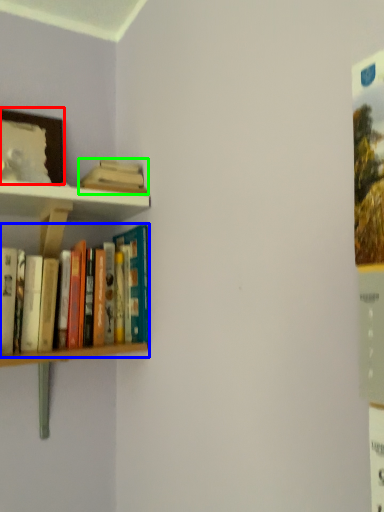
Question: Considering the real-world distances, which object is closest to picture frame (highlighted by a red box)? book (highlighted by a blue box) or book (highlighted by a green box).

Choices:
 (A) book
 (B) book

Answer: (B)